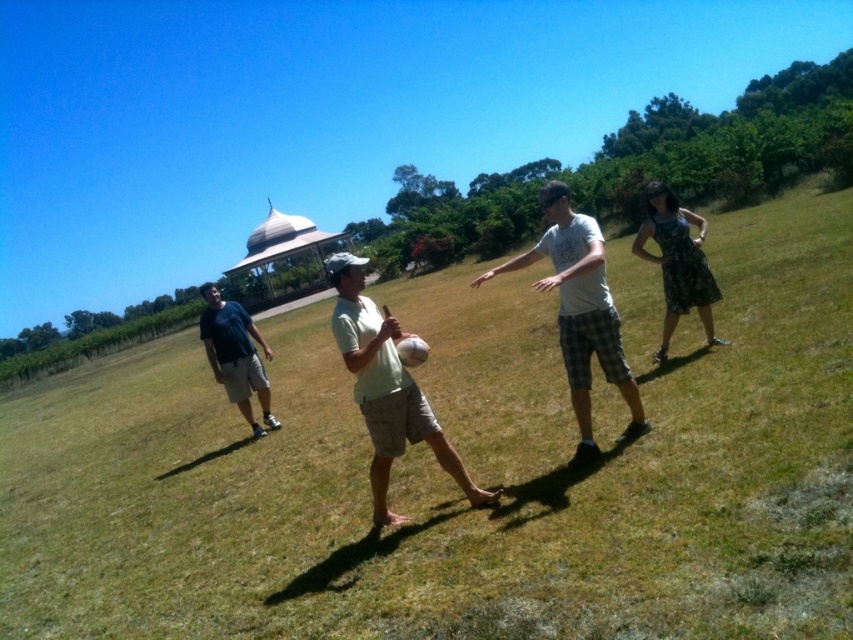
You are standing at the edge of the green grassy field at center and want to walk towards the white cotton shirt at center. Which direction should you walk to reach it?

Answer: Since the green grassy field at center is in front of the white cotton shirt at center, you should walk forward towards the green grassy field at center to reach the white cotton shirt at center.

You are standing in the park and see the green grassy field at center and the white cotton shirt at center. Which object is located higher from the ground?

The green grassy field at center is above the white cotton shirt at center, so the green grassy field at center is higher from the ground.

You are standing at the point marked as point (387, 388) in the image. What object is directly beneath your feet?

The point (387, 388) is on the light green fabric shirt at center, so the object directly beneath your feet is the light green fabric shirt at center.